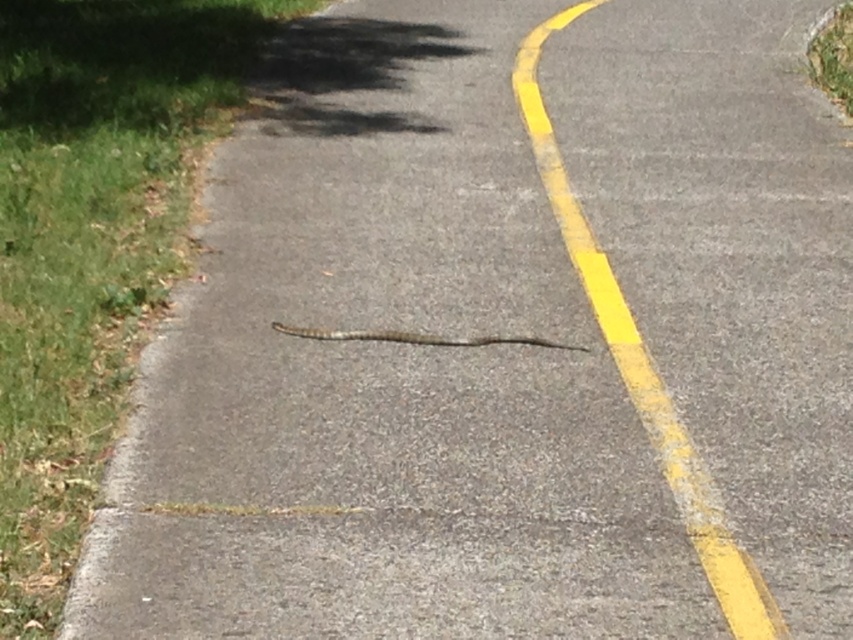
Does yellow asphalt curve at center have a greater height compared to brown scaly snake at center?

Indeed, yellow asphalt curve at center has a greater height compared to brown scaly snake at center.

Is yellow asphalt curve at center shorter than brown scaly snake at center?

No.

You are a GUI agent. You are given a task and a screenshot of the screen. Output one action in this format:
    pyautogui.click(x=<x>, y=<y>)
    Task: Click on the yellow asphalt curve at center
    
    Given the screenshot: What is the action you would take?
    pyautogui.click(x=642, y=365)

Where is `yellow asphalt curve at center`? The image size is (853, 640). yellow asphalt curve at center is located at coordinates (642, 365).